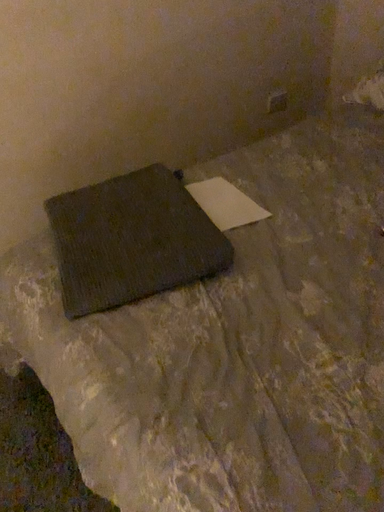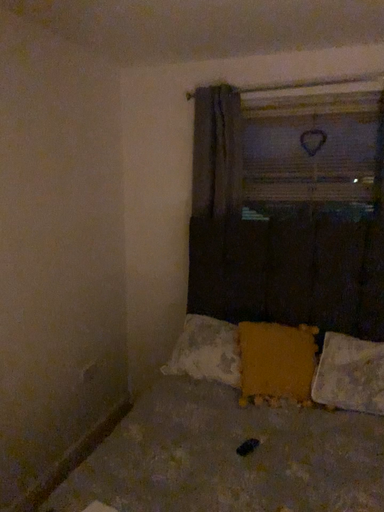
Question: How did the camera likely rotate when shooting the video?

Choices:
 (A) rotated downward
 (B) rotated upward

Answer: (B)